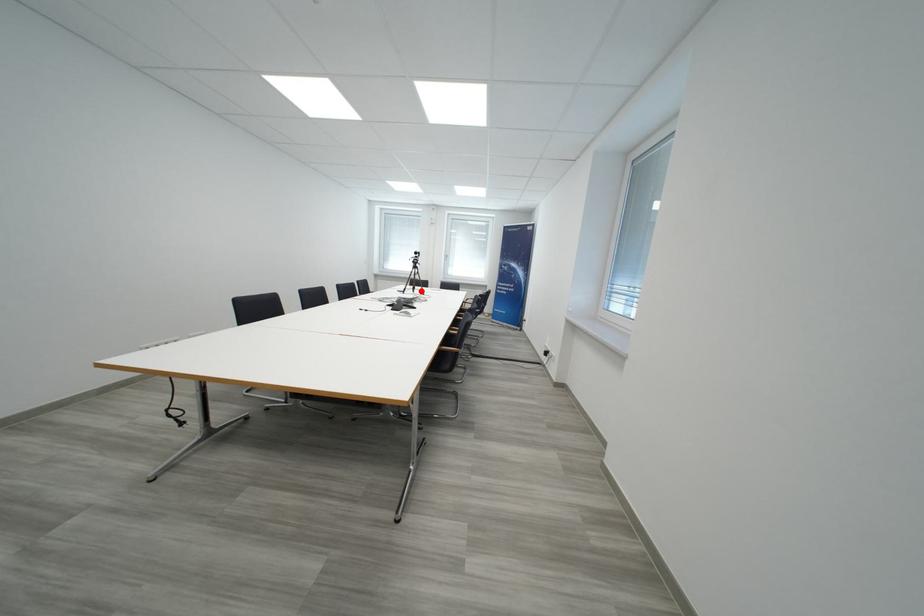
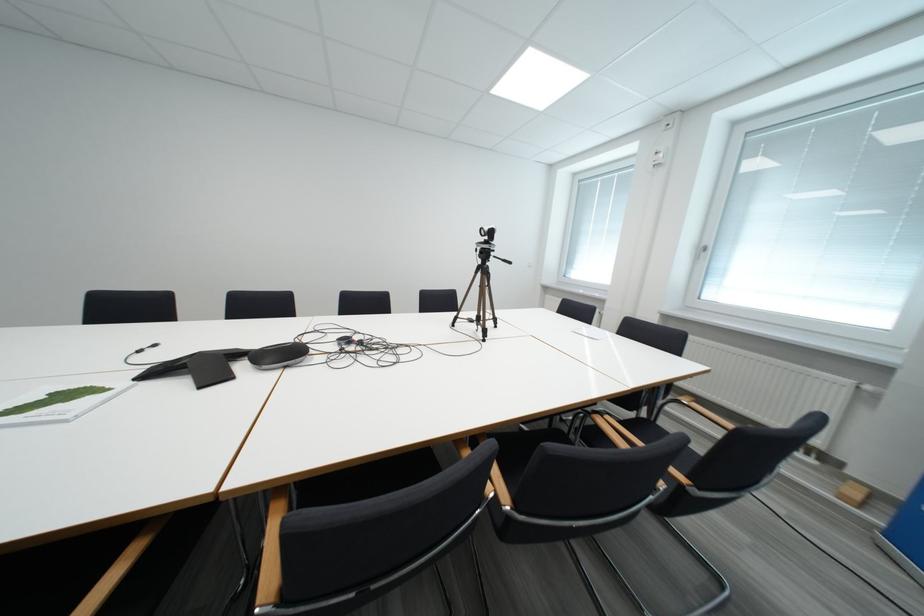
Question: I am providing you with two images of the same scene from different viewpoints. Image1 has a red point marked. In image2, the corresponding 3D location appears at what relative position? Reply with the corresponding letter.

Choices:
 (A) Closer
 (B) Farther

Answer: (B)